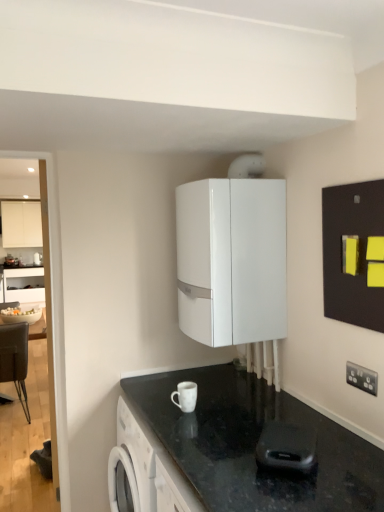
Identify the location of free spot in front of black rubber remote control at lower center, the first appliance in the right-to-left sequence. The image size is (384, 512). (293, 497).